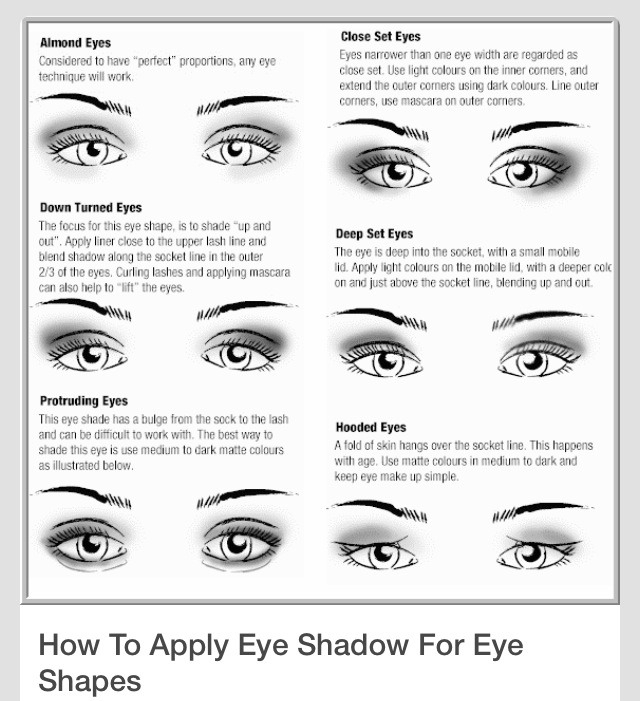
Identify the location of corner. (22, 599), (614, 599), (614, 22), (32, 26).